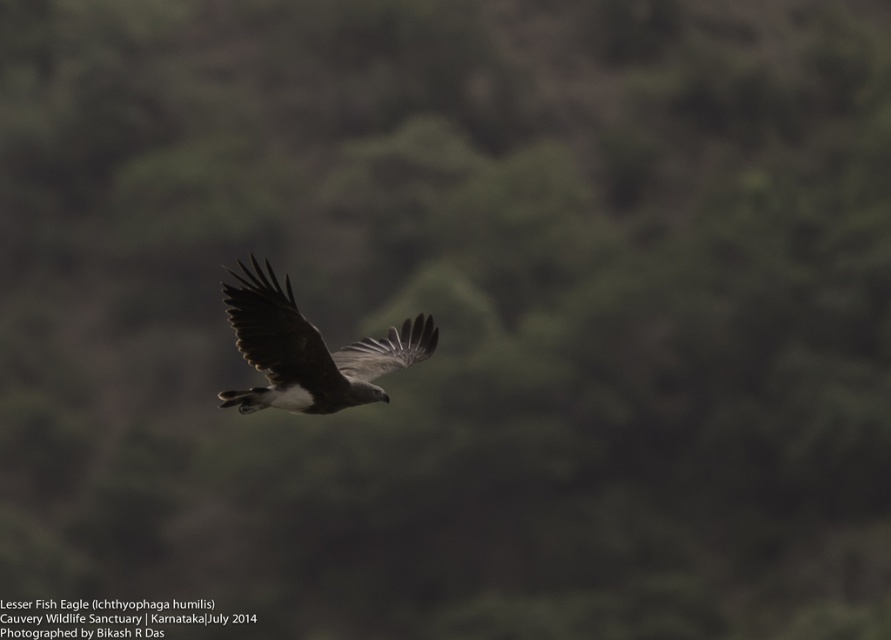
Question: Does brown feathered eagle at center appear under dark gray feathered wing at center?

Choices:
 (A) yes
 (B) no

Answer: (B)

Question: Can you confirm if brown feathered eagle at center is wider than dark gray feathered wing at center?

Choices:
 (A) yes
 (B) no

Answer: (A)

Question: Is brown feathered eagle at center to the left of dark brown feathered wing at center from the viewer's perspective?

Choices:
 (A) no
 (B) yes

Answer: (A)

Question: Which of the following is the closest to the observer?

Choices:
 (A) (323, 413)
 (B) (393, 342)

Answer: (A)

Question: Among these points, which one is nearest to the camera?

Choices:
 (A) (241, 294)
 (B) (299, 378)

Answer: (A)

Question: Considering the real-world distances, which object is closest to the dark gray feathered wing at center?

Choices:
 (A) dark brown feathered wing at center
 (B) brown feathered eagle at center

Answer: (B)